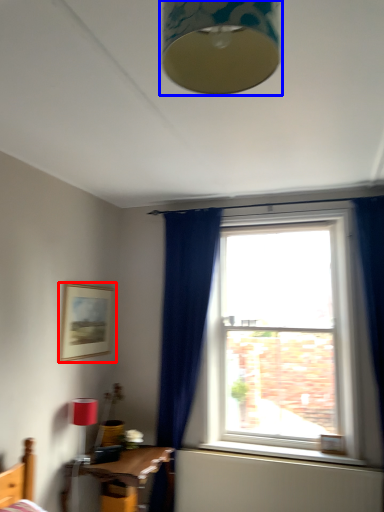
Question: Which point is closer to the camera, picture frame (highlighted by a red box) or lamp (highlighted by a blue box)?

Choices:
 (A) picture frame
 (B) lamp

Answer: (B)